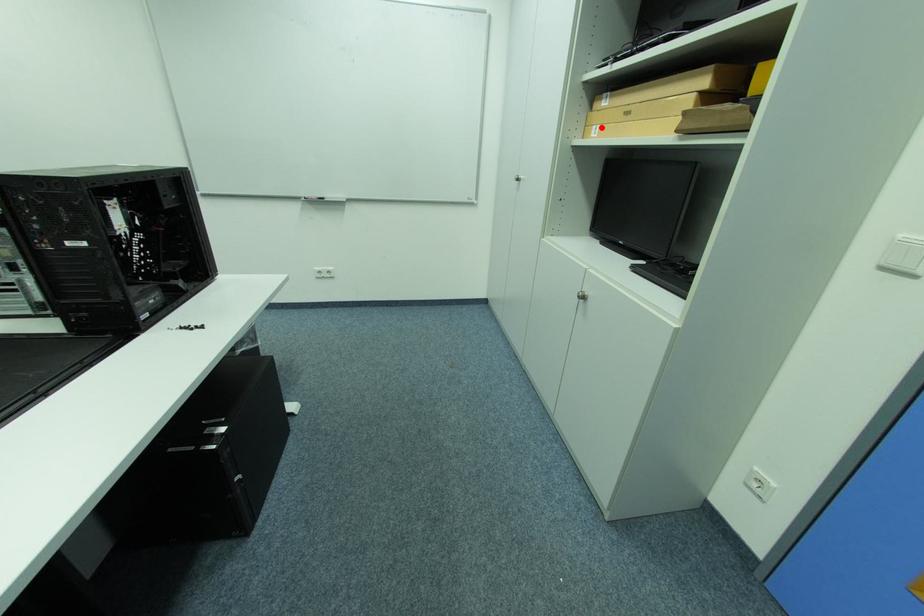
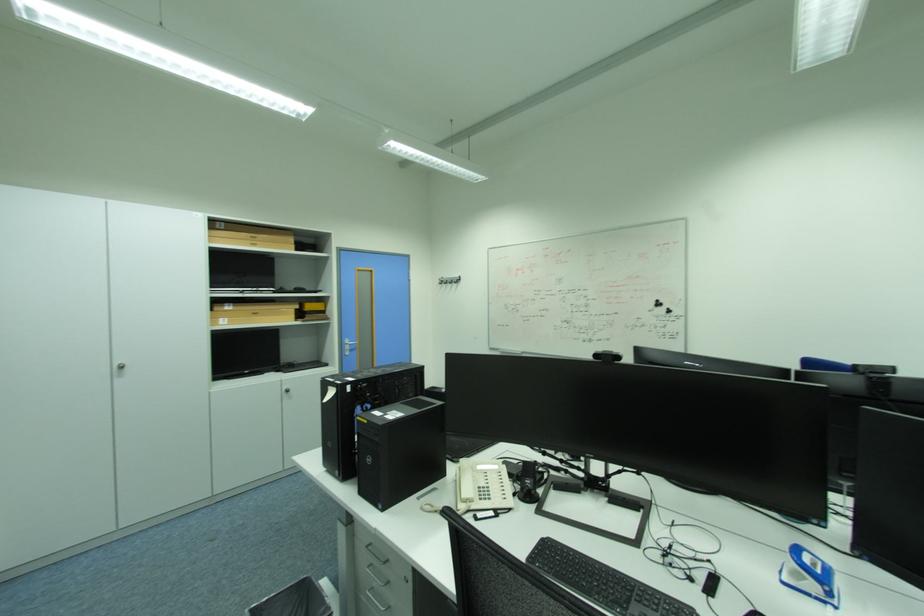
The point at the highlighted location is marked in the first image. Where is the corresponding point in the second image?

(228, 320)